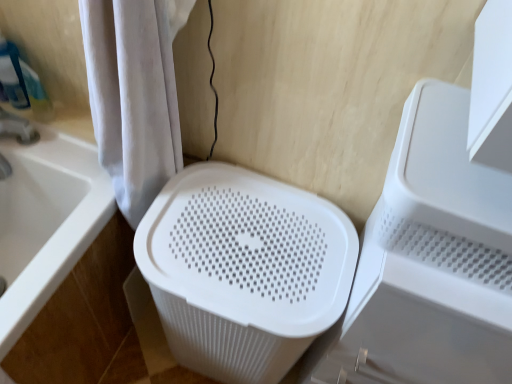
At what (x,y) coordinates should I click in order to perform the action: click on empty space that is ontop of white plastic laundry basket at center (from a real-world perspective). Please return your answer as a coordinate pair (x, y). The height and width of the screenshot is (384, 512). Looking at the image, I should click on (246, 243).